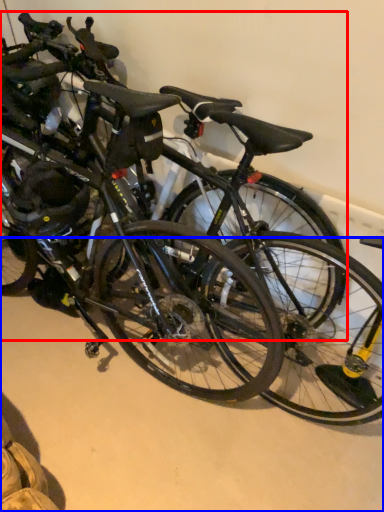
Question: Which of the following is the farthest to the observer, bicycle (highlighted by a red box) or concrete (highlighted by a blue box)?

Choices:
 (A) bicycle
 (B) concrete

Answer: (B)